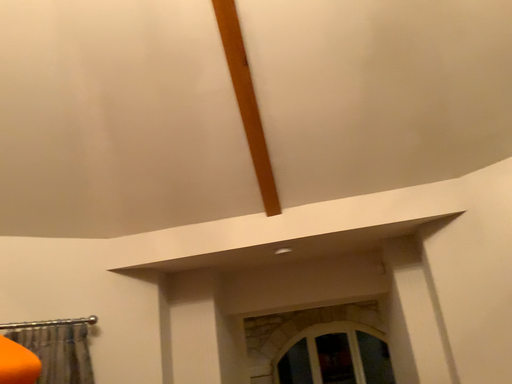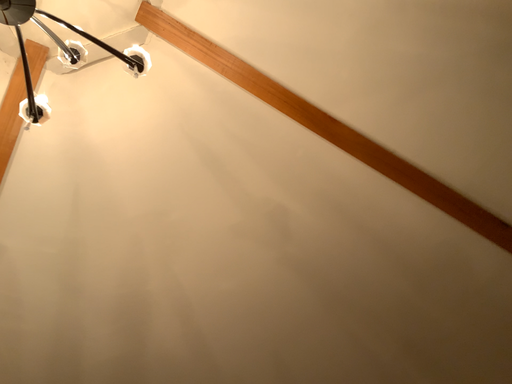
Question: How did the camera likely rotate when shooting the video?

Choices:
 (A) rotated upward
 (B) rotated downward

Answer: (A)